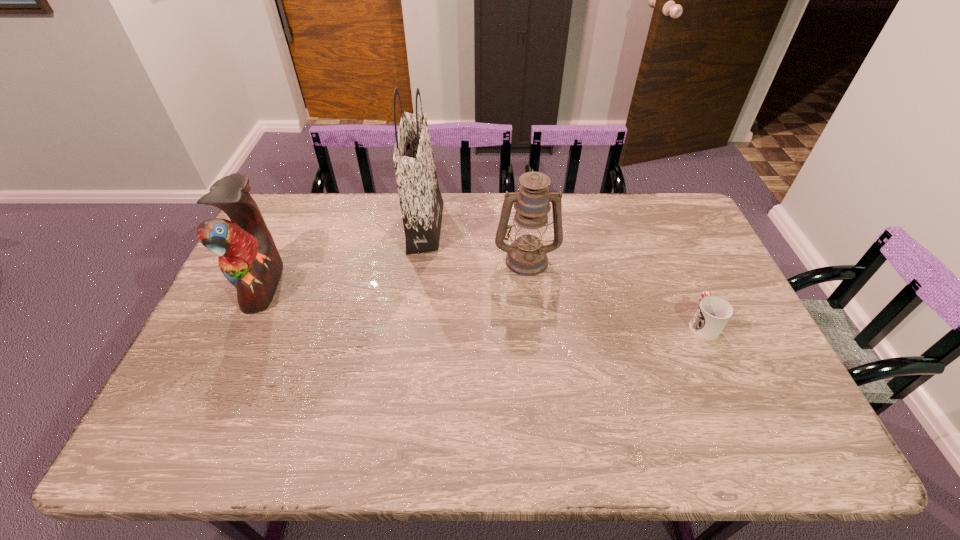
Locate an element on the screen. The image size is (960, 540). the second object from left to right is located at coordinates (421, 202).

Find the location of a particular element. The image size is (960, 540). shopping bag is located at coordinates (421, 202).

Where is `the leftmost object`? the leftmost object is located at coordinates (248, 258).

This screenshot has width=960, height=540. In order to click on oil lamp in this screenshot , I will do `click(527, 256)`.

Locate an element on the screen. The image size is (960, 540). the rightmost object is located at coordinates (713, 313).

Identify the location of the shortest object. This screenshot has height=540, width=960. (713, 313).

Where is `free location located 0.360m on the front of the third object from right to left with the design`? The height and width of the screenshot is (540, 960). free location located 0.360m on the front of the third object from right to left with the design is located at coordinates (545, 227).

Image resolution: width=960 pixels, height=540 pixels. I want to click on free point located 0.330m at the face of the leftmost object, so click(390, 285).

This screenshot has height=540, width=960. Find the location of `free spot located on the left of the oil lamp`. free spot located on the left of the oil lamp is located at coordinates (372, 259).

Find the location of a particular element. free point located 0.070m on the handle side of the rightmost object is located at coordinates (687, 290).